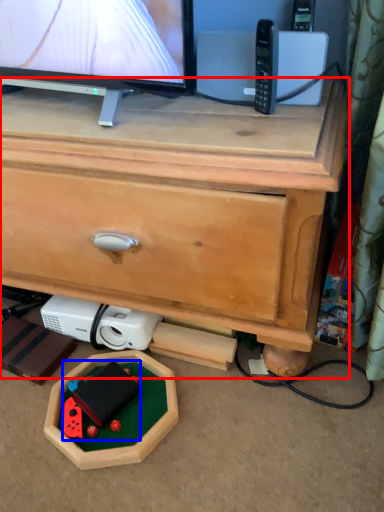
Question: Which object is closer to the camera taking this photo, chest of drawers (highlighted by a red box) or toy (highlighted by a blue box)?

Choices:
 (A) chest of drawers
 (B) toy

Answer: (A)